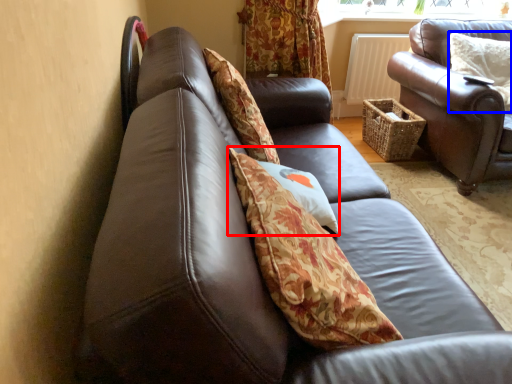
Question: Which point is closer to the camera, pillow (highlighted by a red box) or pillow (highlighted by a blue box)?

Choices:
 (A) pillow
 (B) pillow

Answer: (A)